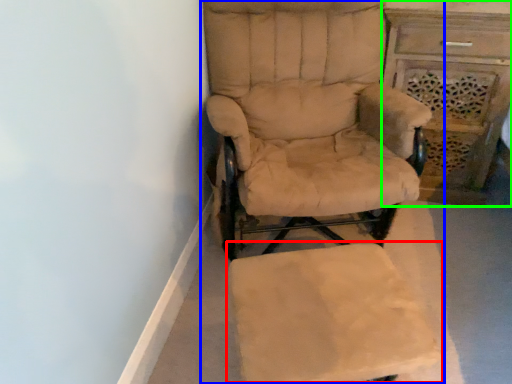
Question: Estimate the real-world distances between objects in this image. Which object is closer to swivel chair (highlighted by a red box), chair (highlighted by a blue box) or vanity (highlighted by a green box)?

Choices:
 (A) chair
 (B) vanity

Answer: (A)